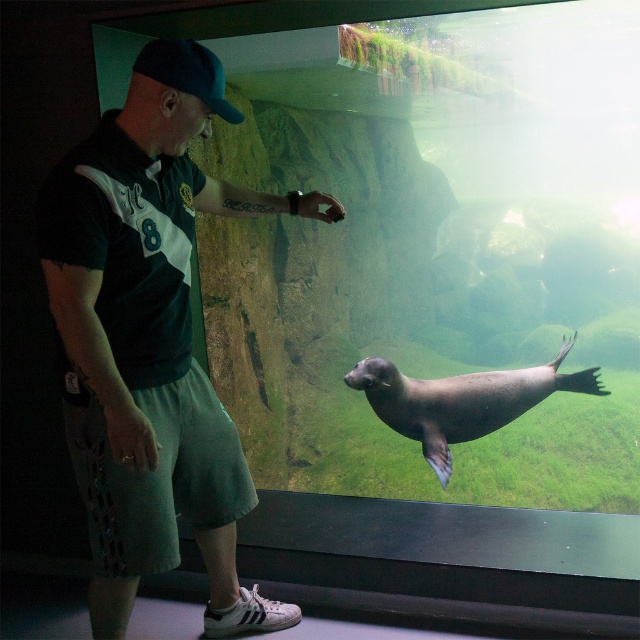
Question: Is dark green jersey at center wider than dark blue fabric baseball cap at upper left?

Choices:
 (A) no
 (B) yes

Answer: (B)

Question: Is smooth gray seal at center to the left of dark blue fabric baseball cap at upper left from the viewer's perspective?

Choices:
 (A) no
 (B) yes

Answer: (A)

Question: Does dark green jersey at center have a smaller size compared to dark blue fabric baseball cap at upper left?

Choices:
 (A) no
 (B) yes

Answer: (A)

Question: Estimate the real-world distances between objects in this image. Which object is farther from the dark green jersey at center?

Choices:
 (A) smooth gray seal at center
 (B) dark blue fabric baseball cap at upper left

Answer: (A)

Question: Which object is positioned closest to the dark green jersey at center?

Choices:
 (A) smooth gray seal at center
 (B) dark blue fabric baseball cap at upper left

Answer: (B)

Question: Which point is closer to the camera?

Choices:
 (A) (193, 68)
 (B) (522, 380)
 (C) (134, 113)

Answer: (C)